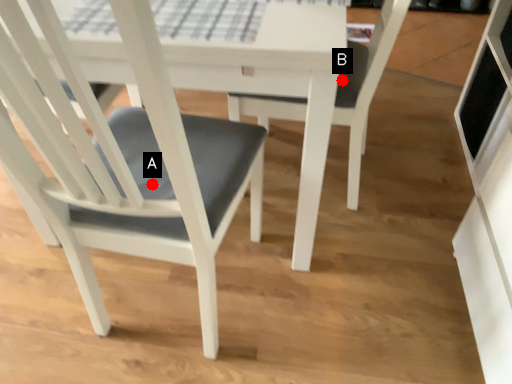
Question: Two points are circled on the image, labeled by A and B beside each circle. Among these points, which one is nearest to the camera?

Choices:
 (A) A is closer
 (B) B is closer

Answer: (A)